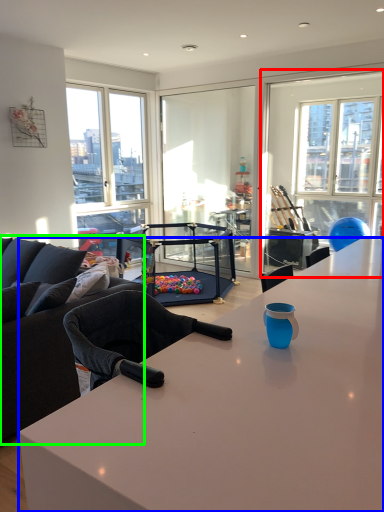
Question: Based on their relative distances, which object is nearer to window screen (highlighted by a red box)? Choose from desk (highlighted by a blue box) and studio couch (highlighted by a green box).

Choices:
 (A) desk
 (B) studio couch

Answer: (B)